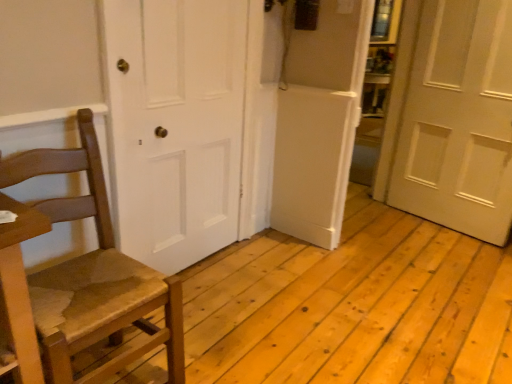
Question: In terms of height, does white matte door at right, the second door in the left-to-right sequence, look taller or shorter compared to wooden chair at left?

Choices:
 (A) short
 (B) tall

Answer: (B)

Question: From a real-world perspective, is white matte door at right, positioned as the first door in right-to-left order, physically located above or below wooden chair at left?

Choices:
 (A) above
 (B) below

Answer: (A)

Question: Which object is the closest to the wooden chair at left?

Choices:
 (A) white matte door at right, positioned as the first door in right-to-left order
 (B) white matte door at center, which is counted as the 1th door, starting from the left

Answer: (B)

Question: Which object is positioned closest to the white matte door at right, the second door in the left-to-right sequence?

Choices:
 (A) white matte door at center, which ranks as the 2th door in right-to-left order
 (B) wooden chair at left

Answer: (A)